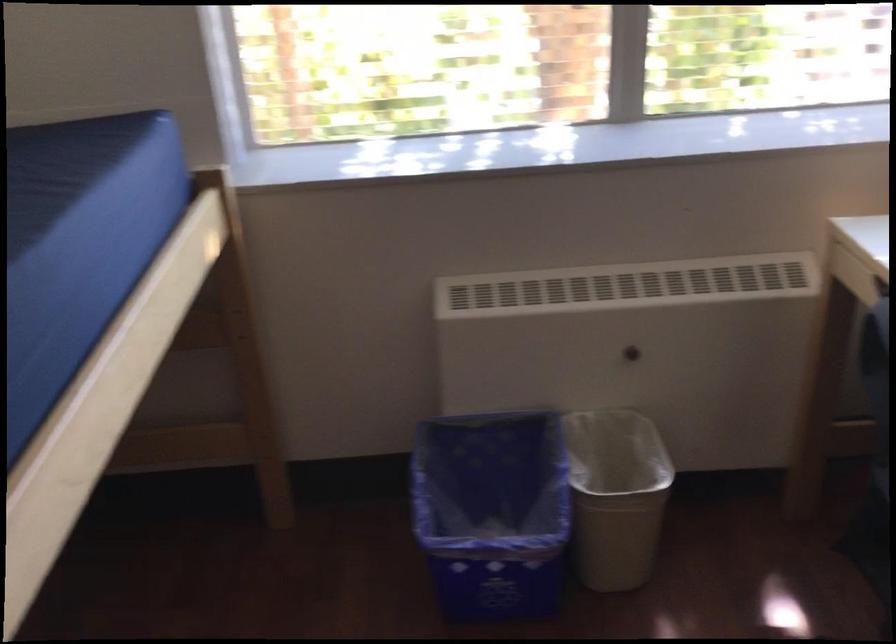
I want to click on radiator knob, so click(x=634, y=351).